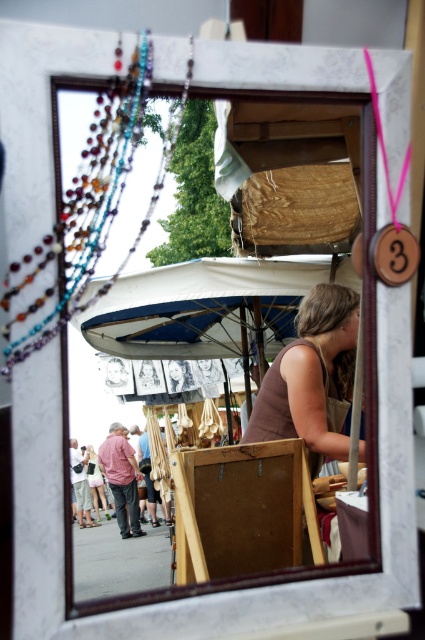
Question: Is multicolored beaded necklace at upper left further to camera compared to brown matte tank top at center?

Choices:
 (A) yes
 (B) no

Answer: (B)

Question: Which object is farther from the camera taking this photo?

Choices:
 (A) white fabric canopy at center
 (B) brown matte tank top at center
 (C) multicolored beaded necklace at upper left
 (D) light pink fabric dress at lower left

Answer: (D)

Question: Which object appears farthest from the camera in this image?

Choices:
 (A) multicolored beaded necklace at upper left
 (B) brown matte tank top at center

Answer: (B)

Question: Which is farther from the white fabric canopy at center?

Choices:
 (A) light pink fabric dress at lower left
 (B) multicolored beaded necklace at upper left
 (C) brown matte tank top at center

Answer: (A)

Question: Can you confirm if multicolored beaded necklace at upper left is positioned to the right of light pink fabric dress at lower left?

Choices:
 (A) yes
 (B) no

Answer: (A)

Question: Is multicolored beaded necklace at upper left wider than brown matte tank top at center?

Choices:
 (A) yes
 (B) no

Answer: (B)